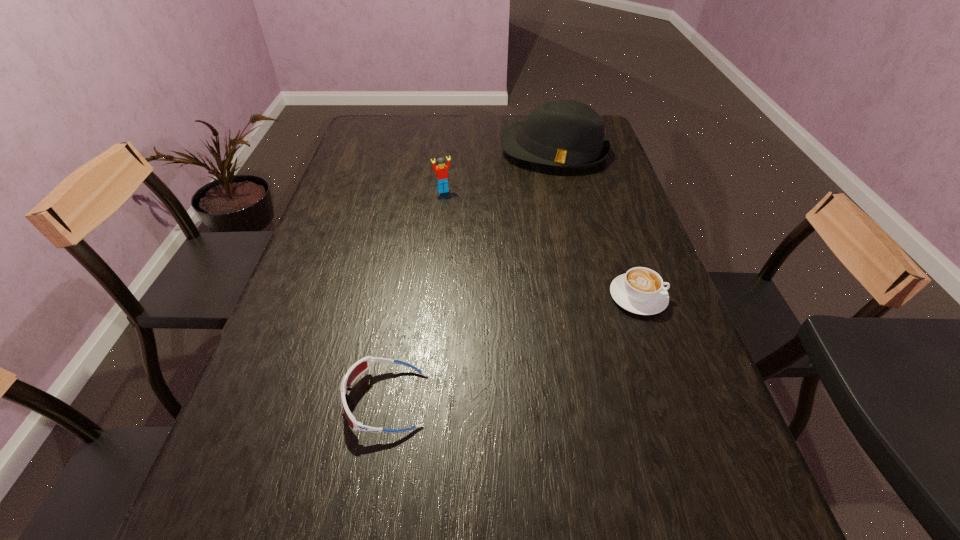
The height and width of the screenshot is (540, 960). In order to click on vacant spot on the desktop that is between the nearest object and the second nearest object and is positioned on the face of the third nearest object in this screenshot , I will do `click(521, 345)`.

You are a GUI agent. You are given a task and a screenshot of the screen. Output one action in this format:
    pyautogui.click(x=<x>, y=<y>)
    Task: Click on the free spot on the desktop that is between the nearest object and the third farthest object and is positioned on the front-facing side of the fedora
    The height and width of the screenshot is (540, 960).
    Given the screenshot: What is the action you would take?
    pyautogui.click(x=519, y=346)